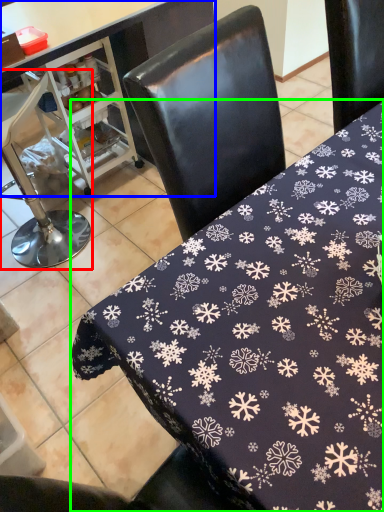
Question: Based on their relative distances, which object is nearer to chair (highlighted by a red box)? Choose from table (highlighted by a blue box) and table (highlighted by a green box).

Choices:
 (A) table
 (B) table

Answer: (A)